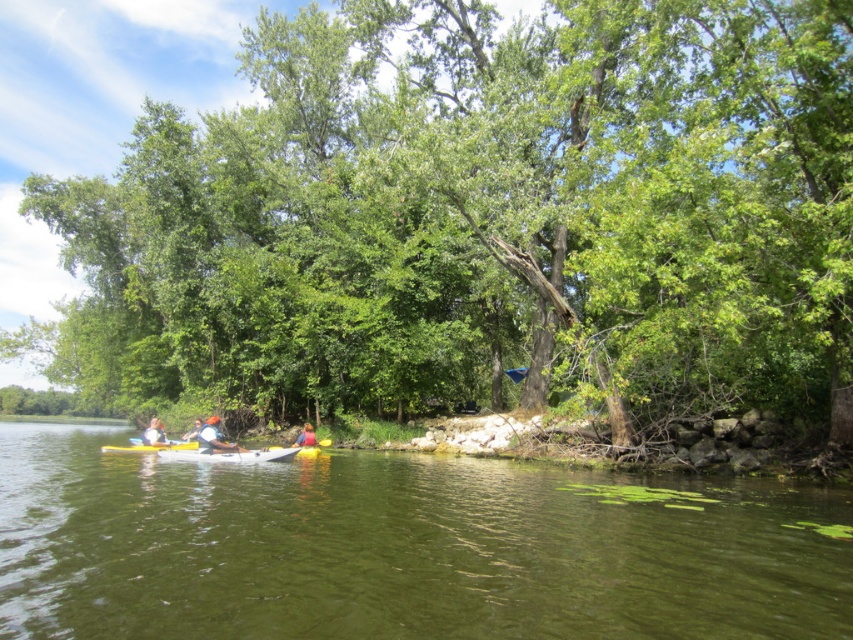
You are standing at the edge of the water and see the point labeled as point (213, 436). What object is located at that point?

The point (213, 436) corresponds to the white fabric kayak at center.

You are planning to store the white fabric kayak at lower left and the white plastic kayak at center in a vertical storage rack. Which kayak will require more vertical space due to its height?

The white fabric kayak at lower left requires more vertical space because it has a greater height compared to the white plastic kayak at center.